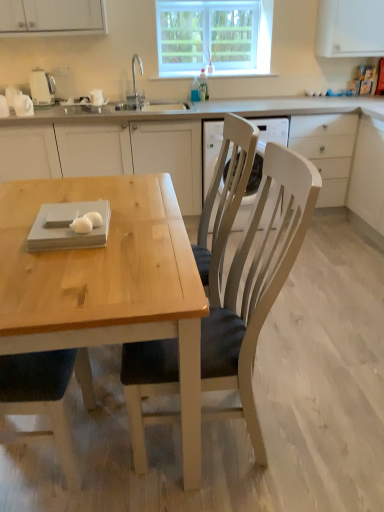
Where is `free space to the left of wooden chair at center`? This screenshot has height=512, width=384. free space to the left of wooden chair at center is located at coordinates (87, 443).